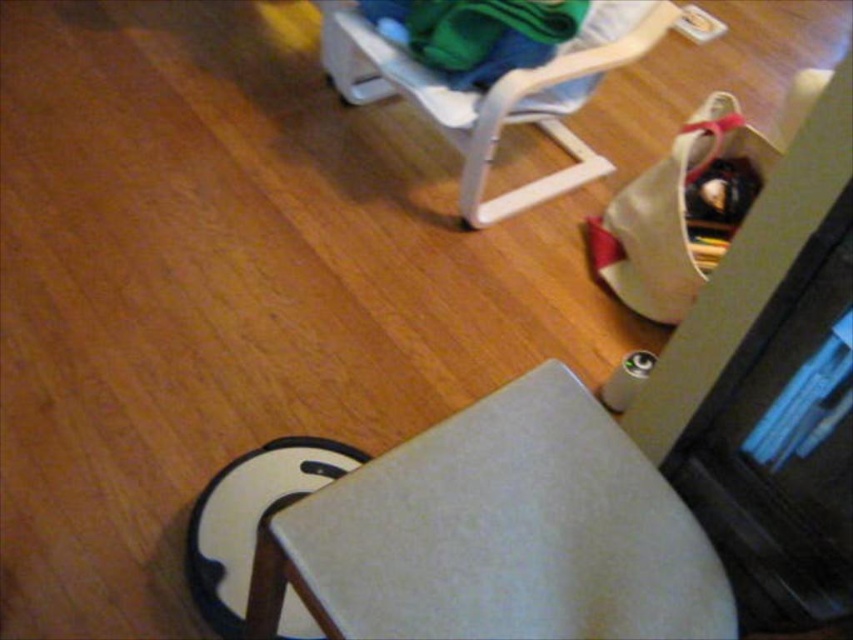
Can you confirm if matte gray cushion at lower center is bigger than white plastic folding chair at upper center?

Actually, matte gray cushion at lower center might be smaller than white plastic folding chair at upper center.

Between matte gray cushion at lower center and white plastic folding chair at upper center, which one is positioned lower?

matte gray cushion at lower center

Who is more forward, (393, 564) or (431, 97)?

Point (393, 564) is in front.

What are the coordinates of `matte gray cushion at lower center` in the screenshot? It's located at (498, 532).